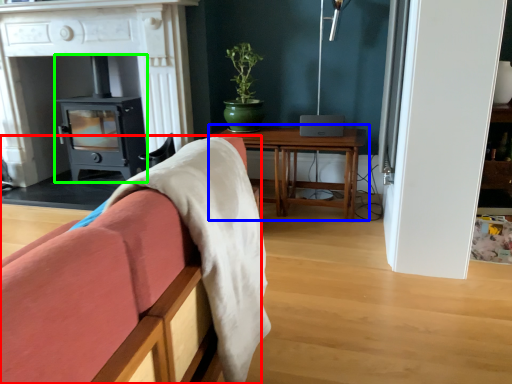
Question: Considering the real-world distances, which object is farthest from furniture (highlighted by a red box)? table (highlighted by a blue box) or wood burning stove (highlighted by a green box)?

Choices:
 (A) table
 (B) wood burning stove

Answer: (B)